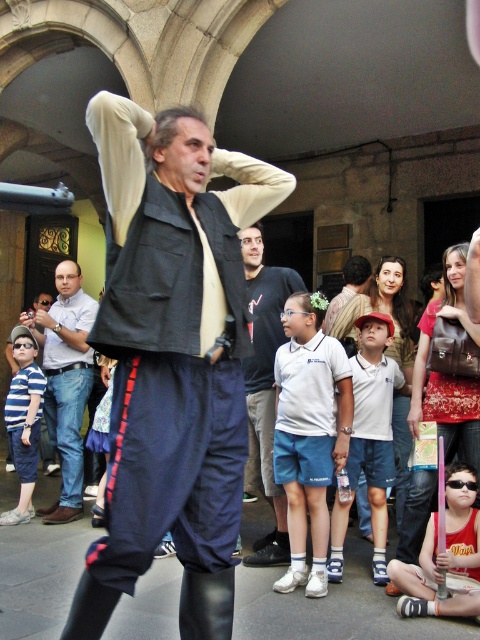
Question: Is light blue jeans at center above reddish-brown fabric shorts at lower right?

Choices:
 (A) yes
 (B) no

Answer: (A)

Question: Estimate the real-world distances between objects in this image. Which object is closer to the light blue jeans at center?

Choices:
 (A) reddish-brown fabric shorts at lower right
 (B) white cotton shirt at center

Answer: (B)

Question: Is matte black vest at center wider than white cotton shirt at center?

Choices:
 (A) no
 (B) yes

Answer: (B)

Question: Which object appears farthest from the camera in this image?

Choices:
 (A) reddish-brown fabric shorts at lower right
 (B) striped cotton shirt at center

Answer: (B)

Question: Does matte black vest at center appear under reddish-brown fabric shorts at lower right?

Choices:
 (A) yes
 (B) no

Answer: (B)

Question: Among these points, which one is farthest from the camera?

Choices:
 (A) (415, 390)
 (B) (190, 241)
 (C) (282, 292)

Answer: (C)